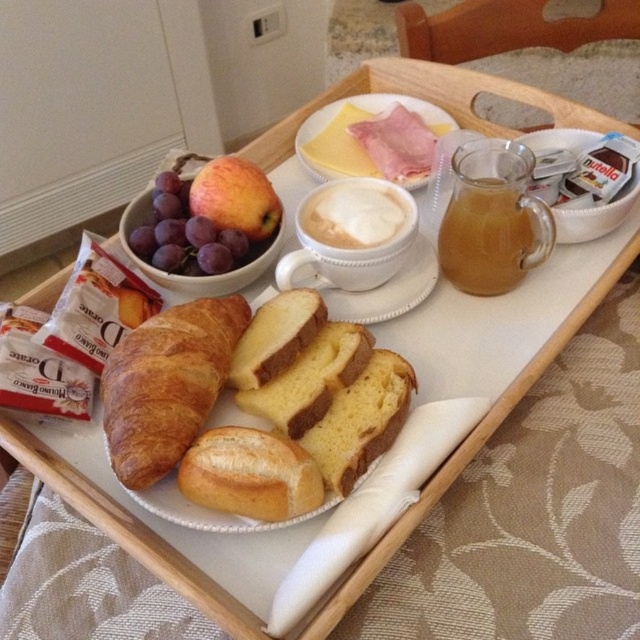
You are a guest staying in a hotel and see the breakfast tray with the golden brown croissant at left and the yellow sponge cake at center. Which item is positioned more to the left?

The golden brown croissant at left is positioned more to the left than the yellow sponge cake at center.

You are a guest in a hotel room and want to reach for the golden brown croissant at left. Based on its coordinates, where exactly should you look on the tray?

The golden brown croissant at left is located at point 0.602 on the x axis and 0.261 on the y axis of the tray.